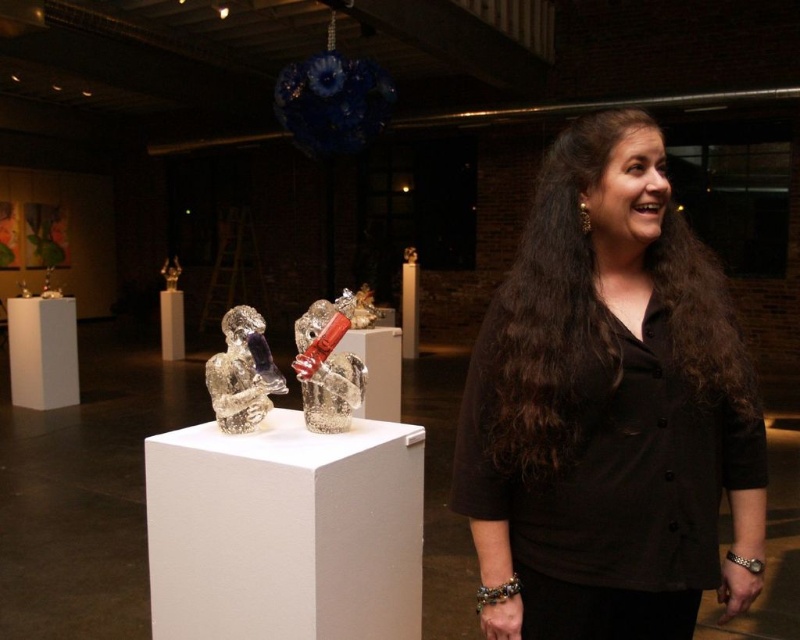
Looking at this image, can you confirm if clear glass sculpture at center is smaller than clear glass sculpture at left?

Incorrect, clear glass sculpture at center is not smaller in size than clear glass sculpture at left.

Between clear glass sculpture at center and clear glass sculpture at left, which one is positioned higher?

clear glass sculpture at left is above.

Consider the image. Who is more distant from viewer, (316, 305) or (244, 324)?

Point (244, 324)

You are a GUI agent. You are given a task and a screenshot of the screen. Output one action in this format:
    pyautogui.click(x=<x>, y=<y>)
    Task: Click on the clear glass sculpture at center
    The image size is (800, 640).
    Given the screenshot: What is the action you would take?
    pyautogui.click(x=328, y=365)

Is black matte shirt at center positioned behind clear glass sculpture at left?

No, it is not.

Between black matte shirt at center and clear glass sculpture at left, which one is positioned higher?

clear glass sculpture at left is higher up.

Between point (536, 614) and point (244, 332), which one is positioned in front?

Point (536, 614) is more forward.

Find the location of a particular element. The image size is (800, 640). black matte shirt at center is located at coordinates (608, 410).

Where is `black matte shirt at center`? This screenshot has height=640, width=800. black matte shirt at center is located at coordinates (608, 410).

The width and height of the screenshot is (800, 640). Find the location of `black matte shirt at center`. black matte shirt at center is located at coordinates (608, 410).